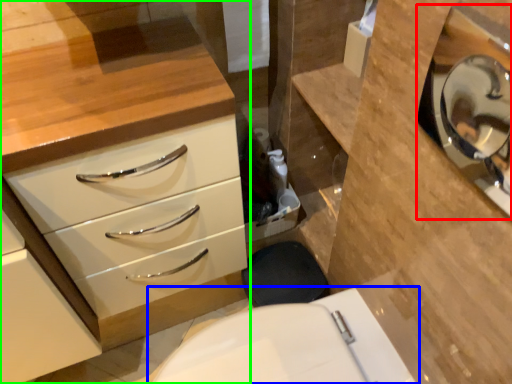
Question: Which is farther away from medicine cabinet (highlighted by a red box)? toilet (highlighted by a blue box) or chest of drawers (highlighted by a green box)?

Choices:
 (A) toilet
 (B) chest of drawers

Answer: (B)